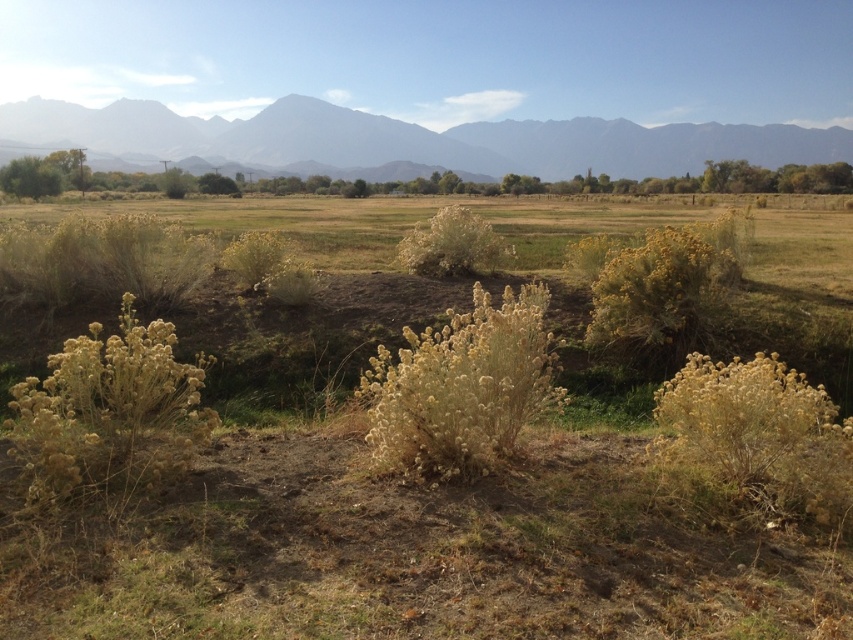
Does fuzzy yellow bush at left lie behind green leafy bush at left?

No, fuzzy yellow bush at left is closer to the viewer.

The width and height of the screenshot is (853, 640). Describe the element at coordinates (109, 413) in the screenshot. I see `fuzzy yellow bush at left` at that location.

What do you see at coordinates (109, 413) in the screenshot?
I see `fuzzy yellow bush at left` at bounding box center [109, 413].

Find the location of a particular element. This screenshot has width=853, height=640. fuzzy yellow bush at left is located at coordinates (109, 413).

Can you confirm if fuzzy yellow bush at left is positioned to the left of fuzzy yellow bush at center?

Yes, fuzzy yellow bush at left is to the left of fuzzy yellow bush at center.

Is point (160, 426) positioned before point (560, 397)?

Yes, it is in front of point (560, 397).

This screenshot has width=853, height=640. Find the location of `fuzzy yellow bush at left`. fuzzy yellow bush at left is located at coordinates (109, 413).

Who is more forward, (567, 150) or (16, 179)?

Point (16, 179) is more forward.

Which is more to the right, gray rocky mountain range at upper center or green leafy bush at left?

gray rocky mountain range at upper center

Is point (715, 156) positioned in front of point (26, 172)?

That is False.

Where is `gray rocky mountain range at upper center`? The height and width of the screenshot is (640, 853). gray rocky mountain range at upper center is located at coordinates (410, 140).